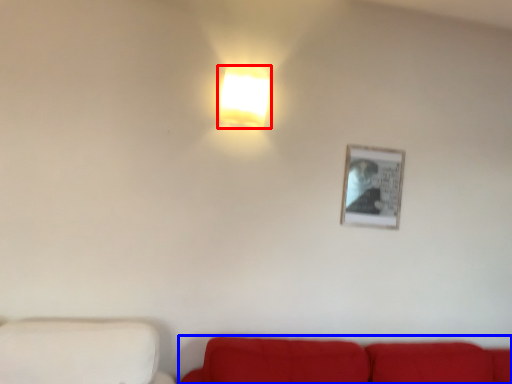
Question: Which object appears closest to the camera in this image, lamp (highlighted by a red box) or studio couch (highlighted by a blue box)?

Choices:
 (A) lamp
 (B) studio couch

Answer: (B)